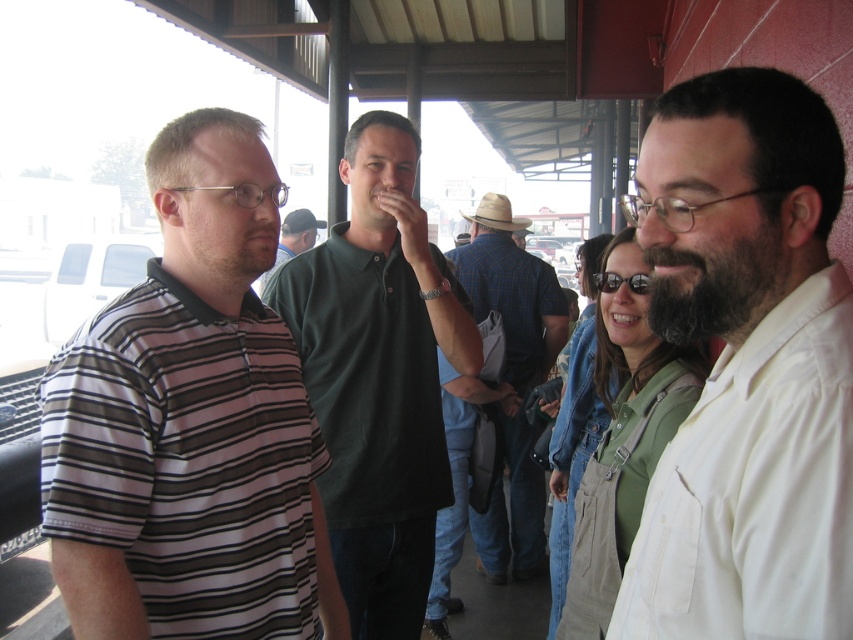
Does dark green polo shirt at center have a greater height compared to dark green shirt at center?

Yes.

This screenshot has height=640, width=853. What are the coordinates of `dark green polo shirt at center` in the screenshot? It's located at (379, 376).

At what (x,y) coordinates should I click in order to perform the action: click on dark green polo shirt at center. Please return your answer as a coordinate pair (x, y). Looking at the image, I should click on (379, 376).

Can you confirm if striped cotton shirt at left is bigger than dark green shirt at center?

Yes, striped cotton shirt at left is bigger than dark green shirt at center.

The height and width of the screenshot is (640, 853). What do you see at coordinates (190, 422) in the screenshot? I see `striped cotton shirt at left` at bounding box center [190, 422].

Locate an element on the screen. This screenshot has width=853, height=640. striped cotton shirt at left is located at coordinates (190, 422).

Where is `green denim overalls at center`? The width and height of the screenshot is (853, 640). green denim overalls at center is located at coordinates (624, 435).

I want to click on green denim overalls at center, so click(x=624, y=435).